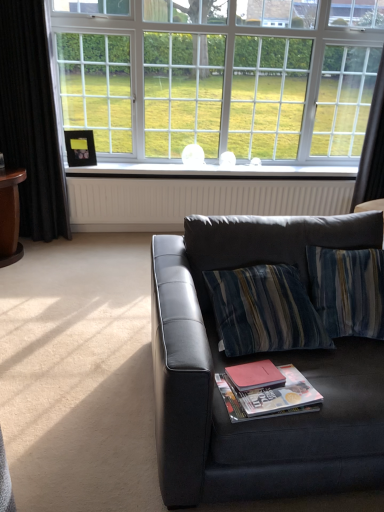
Question: Is matte black couch at center outside white glossy window sill at center?

Choices:
 (A) no
 (B) yes

Answer: (B)

Question: From a real-world perspective, is matte black couch at center below white glossy window sill at center?

Choices:
 (A) no
 (B) yes

Answer: (B)

Question: Would you say matte black couch at center is a long distance from white glossy window sill at center?

Choices:
 (A) no
 (B) yes

Answer: (B)

Question: Is matte black couch at center thinner than white glossy window sill at center?

Choices:
 (A) no
 (B) yes

Answer: (A)

Question: Can you confirm if matte black couch at center is taller than white glossy window sill at center?

Choices:
 (A) yes
 (B) no

Answer: (A)

Question: From the image's perspective, is matte black couch at center located above white glossy window sill at center?

Choices:
 (A) no
 (B) yes

Answer: (A)

Question: Can you confirm if white glossy window sill at center is positioned to the left of matte paper magazine at lower center?

Choices:
 (A) yes
 (B) no

Answer: (B)

Question: Is matte paper magazine at lower center inside white glossy window sill at center?

Choices:
 (A) no
 (B) yes

Answer: (A)

Question: Can you confirm if white glossy window sill at center is taller than matte paper magazine at lower center?

Choices:
 (A) yes
 (B) no

Answer: (A)

Question: From the image's perspective, is white glossy window sill at center beneath matte paper magazine at lower center?

Choices:
 (A) yes
 (B) no

Answer: (B)

Question: Could you tell me if white glossy window sill at center is facing matte paper magazine at lower center?

Choices:
 (A) yes
 (B) no

Answer: (B)

Question: Does white glossy window sill at center lie in front of matte paper magazine at lower center?

Choices:
 (A) yes
 (B) no

Answer: (B)

Question: Is matte black couch at center at the right side of white textured radiator at center?

Choices:
 (A) yes
 (B) no

Answer: (A)